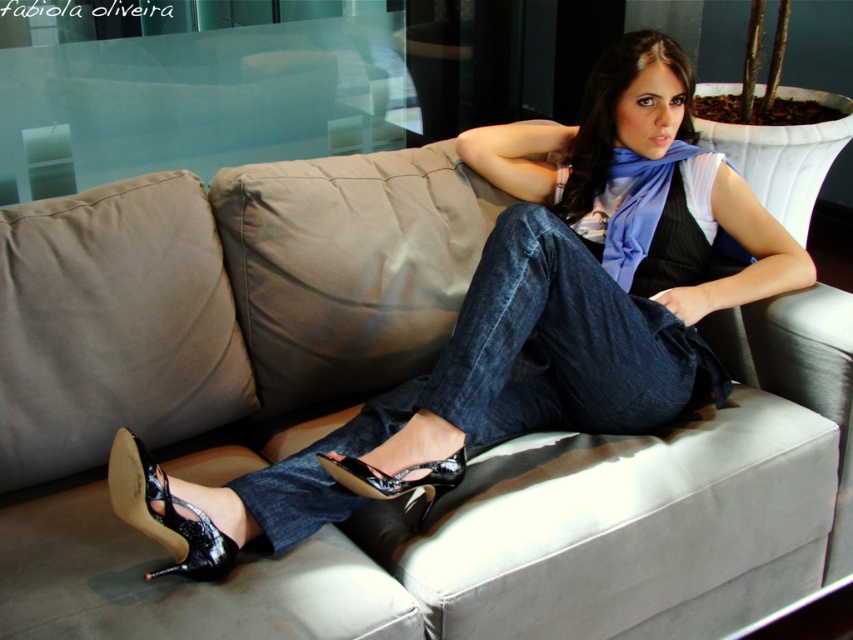
Please describe the location of the denim at center in the image using coordinates. The coordinate system has the origin at the bottom left corner of the image, with the x and y axes increasing to the right and up respectively. The maximum x and y values are both 1.0. Please provide the coordinates as a pair of numbers between 0 and 1, separated by a comma.

The denim at center is located at coordinates approximately (x=512, y=369).

You are a fashion designer observing the woman in the image. You notice the denim at center and the shiny black sandal at lower center. Which item is located to the right of the other?

The denim at center is positioned on the right side of shiny black sandal at lower center.